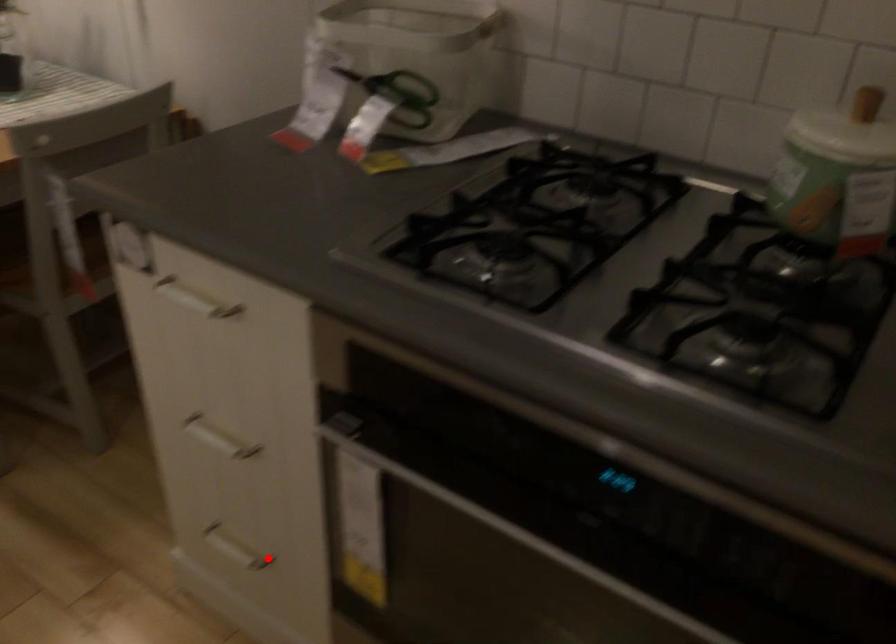
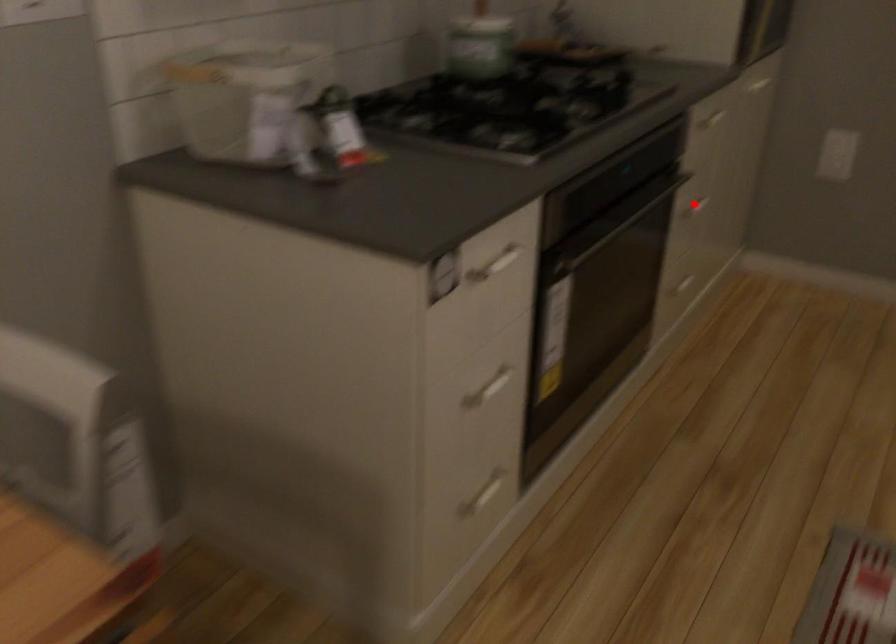
I am providing you with two images of the same scene from different viewpoints. A red point is marked on the first image and another point is marked on the second image. Does the point marked in image1 correspond to the same location as the one in image2?

No